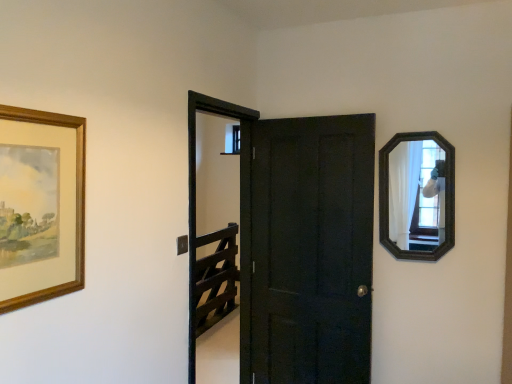
Question: Considering the positions of black wooden screen door at center and wooden picture frame at left in the image, is black wooden screen door at center bigger or smaller than wooden picture frame at left?

Choices:
 (A) small
 (B) big

Answer: (B)

Question: Is black wooden screen door at center wider or thinner than wooden picture frame at left?

Choices:
 (A) wide
 (B) thin

Answer: (A)

Question: Which is nearer to the black wooden screen door at center?

Choices:
 (A) wooden-framed mirror at upper right
 (B) wooden picture frame at left
 (C) matte black door at center

Answer: (C)

Question: Which object is positioned closest to the wooden picture frame at left?

Choices:
 (A) black wooden screen door at center
 (B) wooden-framed mirror at upper right
 (C) matte black door at center

Answer: (A)